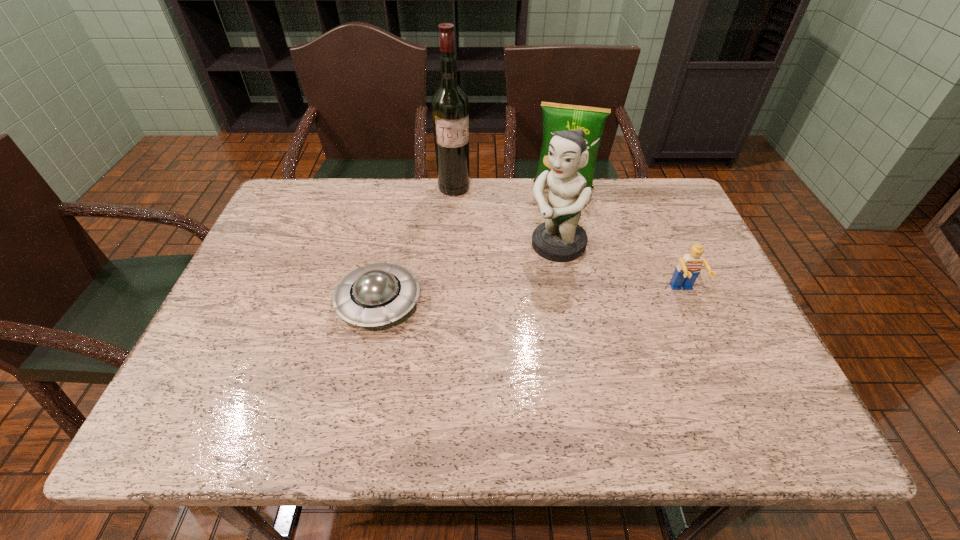
At what (x,y) coordinates should I click in order to perform the action: click on vacant point located on the face of the fourth tallest object. Please return your answer as a coordinate pair (x, y). This screenshot has width=960, height=540. Looking at the image, I should click on (722, 381).

Where is `free space located on the front-facing side of the figurine`? The height and width of the screenshot is (540, 960). free space located on the front-facing side of the figurine is located at coordinates (524, 271).

The width and height of the screenshot is (960, 540). Find the location of `vacant space positioned 0.150m on the front-facing side of the figurine`. vacant space positioned 0.150m on the front-facing side of the figurine is located at coordinates (501, 290).

The width and height of the screenshot is (960, 540). Find the location of `vacant region located on the front-facing side of the figurine`. vacant region located on the front-facing side of the figurine is located at coordinates (469, 316).

Where is `free space located 0.140m on the front-facing side of the third tallest object`? The height and width of the screenshot is (540, 960). free space located 0.140m on the front-facing side of the third tallest object is located at coordinates (553, 223).

Find the location of `vacant space located 0.130m on the front-facing side of the third tallest object`. vacant space located 0.130m on the front-facing side of the third tallest object is located at coordinates (553, 221).

The height and width of the screenshot is (540, 960). In order to click on vacant region located on the front-facing side of the third tallest object in this screenshot , I will do `click(550, 237)`.

Find the location of a particular element. vacant space located 0.400m on the front and back of the wine bottle is located at coordinates (496, 291).

Image resolution: width=960 pixels, height=540 pixels. Identify the location of vacant area situated on the front and back of the wine bottle. (481, 253).

Where is `vacant space situated on the front and back of the wine bottle`? vacant space situated on the front and back of the wine bottle is located at coordinates (479, 248).